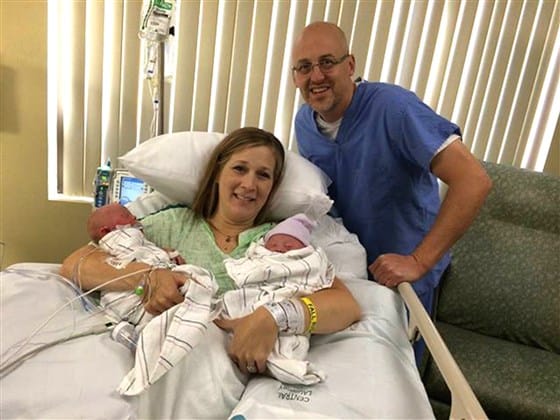
Find the location of `hospital bed`. hospital bed is located at coordinates (431, 336).